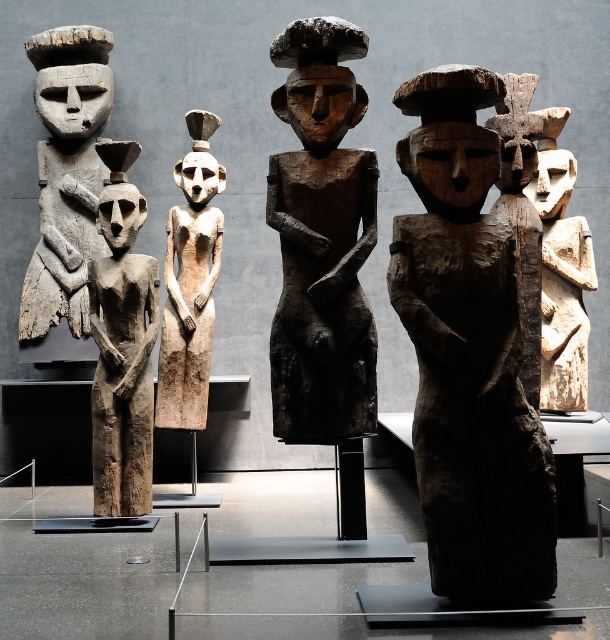
You are a museum curator planning to rearrange the sculptures. You need to place the wooden statue at left and the wooden figure at center on a new shelf that can only hold items up to the size of the smaller one. Which sculpture should you leave behind?

You should leave behind the wooden statue at left because it is bigger than the wooden figure at center, and the shelf can only accommodate items up to the size of the smaller one.

You are a museum curator arranging sculptures. You have a dark wood figure at center and a wooden figure at center. Which one is on the right side?

The dark wood figure at center is positioned on the right side of the wooden figure at center.

You are a museum curator planning to display two sculptures in a new exhibition. You have a dark wood figure at center and a wooden figure at center. Which sculpture should you choose if you want to feature a larger piece in the exhibition?

The dark wood figure at center has a larger size compared to the wooden figure at center, so you should choose the dark wood figure at center for the exhibition.